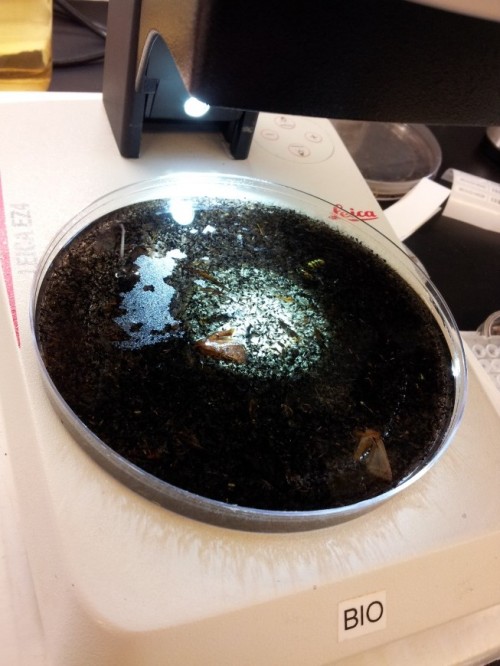
Locate an element on the screen. The image size is (500, 666). light is located at coordinates (197, 105).